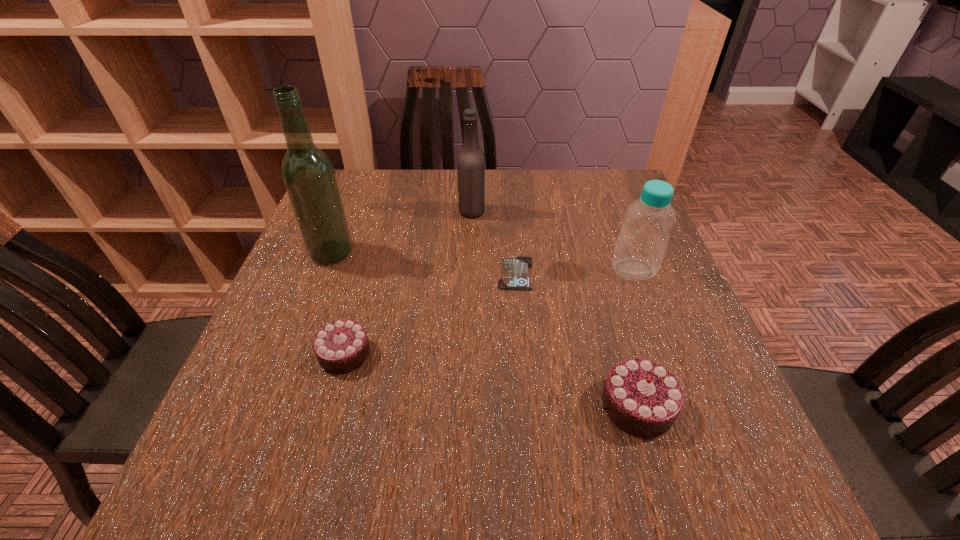
Locate an element on the screen. free space for an extra chocolate_cake to achieve even spacing is located at coordinates (484, 378).